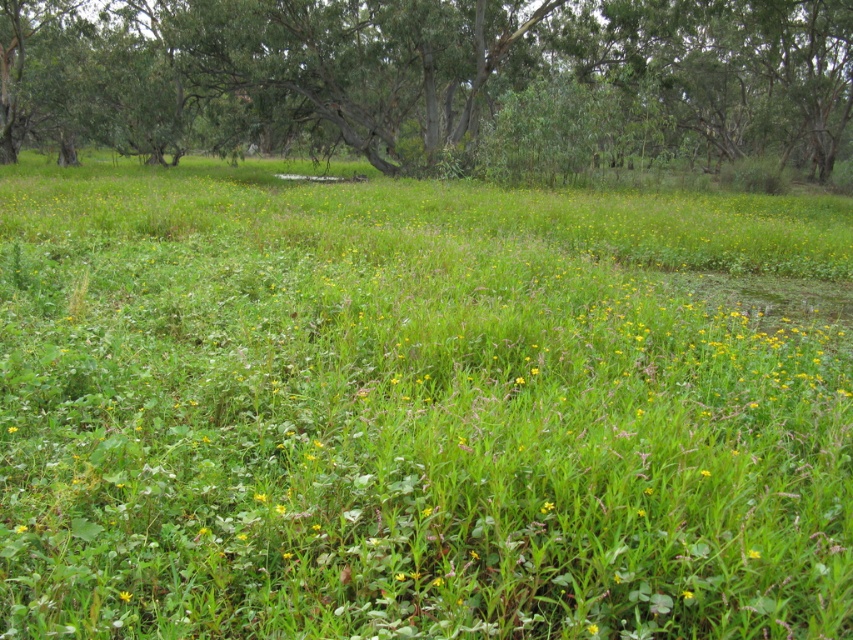
Between green leafy tree at center and yellow matte flower at center, which one has less height?

Standing shorter between the two is yellow matte flower at center.

Who is positioned more to the right, green leafy tree at center or yellow matte flower at center?

green leafy tree at center is more to the right.

Between point (300, 35) and point (129, 596), which one is positioned in front?

Point (129, 596) is in front.

At what (x,y) coordinates should I click in order to perform the action: click on green leafy tree at center. Please return your answer as a coordinate pair (x, y). Image resolution: width=853 pixels, height=640 pixels. Looking at the image, I should click on (426, 76).